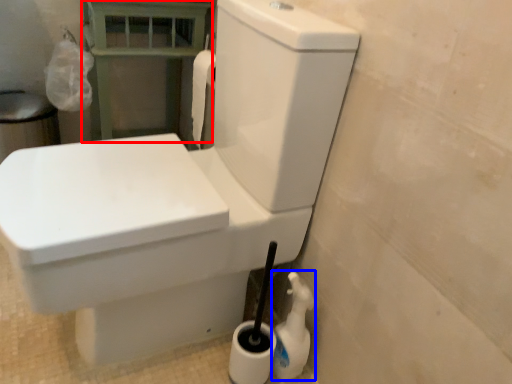
Question: Which point is further to the camera, balustrade (highlighted by a red box) or cleaning product (highlighted by a blue box)?

Choices:
 (A) balustrade
 (B) cleaning product

Answer: (A)